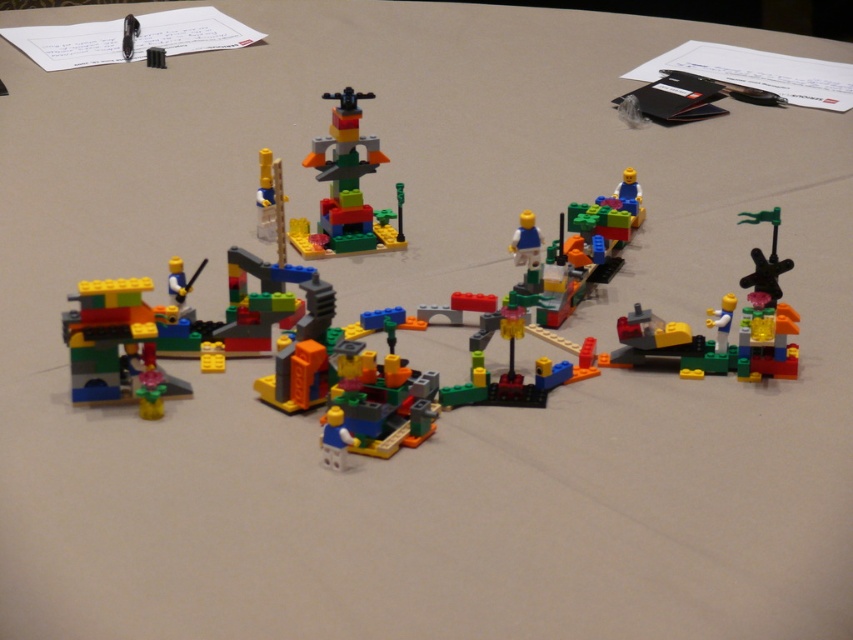
You are trying to decide whether to place a new LEGO piece on the multicolored plastic tower at center or the translucent green plastic spinner at right. Which object has a larger base to support the piece?

The multicolored plastic tower at center might be wider than the translucent green plastic spinner at right, so it likely has a larger base to support the new LEGO piece.

You are a child who wants to build a taller tower than the translucent green plastic spinner at right using the multicolored plastic tower at center. Can you do it?

The multicolored plastic tower at center is already taller than the translucent green plastic spinner at right, so yes, you can build a taller tower using it.

You are a LEGO enthusiast observing the arrangement of LEGO pieces. You notice two points marked in the image. The first point is at coordinate (x=366, y=156) and the second is at (x=776, y=243). From your perspective, which point is closer to you?

Point (x=776, y=243) is closer to you because the description states that point (x=366, y=156) is behind point (x=776, y=243).